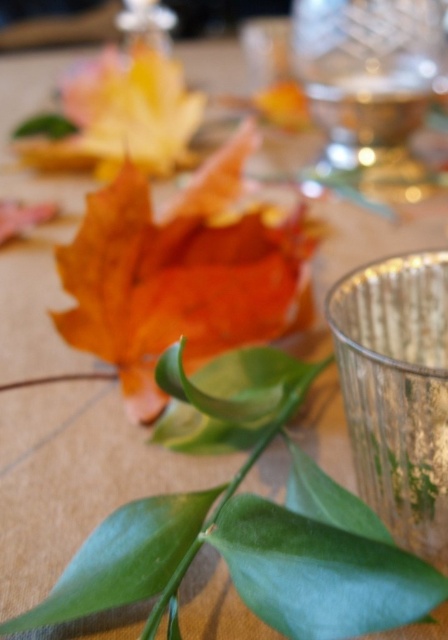
You are arranging a table for a festive event and want to place a decorative item exactly at the center of the table. The orange matte leaf at center is currently positioned at coordinates point 0.427, 0.406. Is the leaf already centered on the table?

The orange matte leaf at center is located at point (x=181, y=273), which is not exactly the center of the table. The exact center would be at coordinates like (x=224, y=320), so the leaf is slightly off to the left and down from the true center.

You are arranging a table for a fall dinner party and need to place the orange matte leaf at center and the clear glass wine glass at upper right. Based on their current positions, which object is closer to the left edge of the table?

The orange matte leaf at center is closer to the left edge of the table because it is positioned on the left side of the clear glass wine glass at upper right.

You are taking a photo of the orange matte leaf at center and the clear glass wine glass at upper right. Which object will appear larger in your photo?

The orange matte leaf at center will appear larger in the photo because it is closer to the viewer than the clear glass wine glass at upper right.